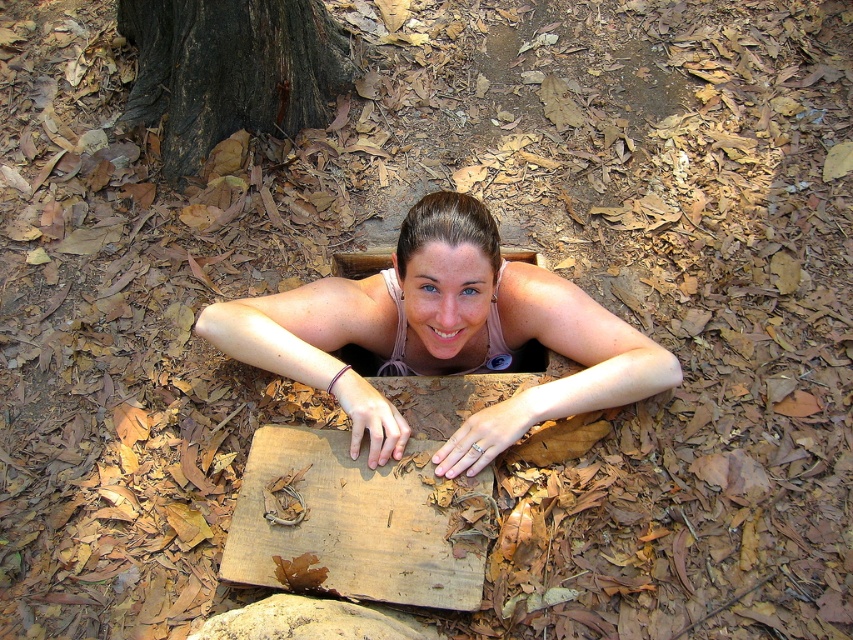
Based on the photo, you are standing at the point with coordinates point [393,372] and want to walk towards the point with coordinates point [379,480]. Which direction should you move?

You should move forward because point [393,372] is behind point [379,480], so moving forward will take you towards the desired point.

Consider the image. You are a carpenter assessing materials for a project. You need to choose between the wooden plank at center and the brown rough bark at upper center based on their thickness. Which one is thicker?

The brown rough bark at upper center is thicker than the wooden plank at center.

In the scene shown: You are an observer looking at the scene. You notice the matte pink tank top at center and the brown rough bark at upper center. Which object is positioned to the right of the other?

The matte pink tank top at center is to the right of the brown rough bark at upper center.